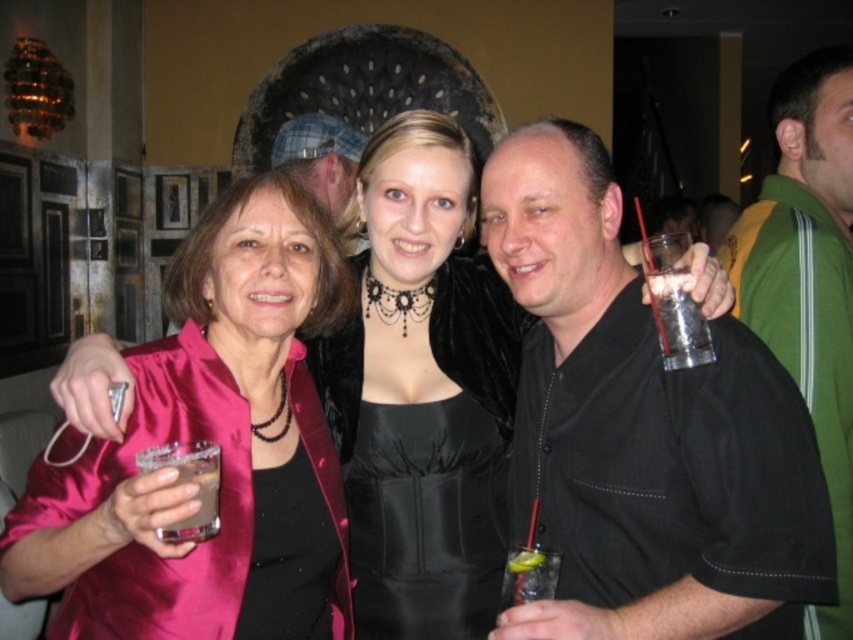
Question: Among these points, which one is farthest from the camera?

Choices:
 (A) (378, 593)
 (B) (351, 138)

Answer: (B)

Question: Which point is closer to the camera?

Choices:
 (A) (x=500, y=209)
 (B) (x=202, y=467)
 (C) (x=432, y=152)
 (D) (x=184, y=557)

Answer: (B)

Question: Is satin pink jacket at left to the right of green fabric jacket at right from the viewer's perspective?

Choices:
 (A) yes
 (B) no

Answer: (B)

Question: Considering the real-world distances, which object is farthest from the satin pink dress at center?

Choices:
 (A) satin pink jacket at left
 (B) brown liquid at lower left
 (C) clear glass at right

Answer: (B)

Question: Is black satin dress at center wider than clear glass at right?

Choices:
 (A) no
 (B) yes

Answer: (B)

Question: Is black satin dress at center bigger than clear glass at right?

Choices:
 (A) yes
 (B) no

Answer: (A)